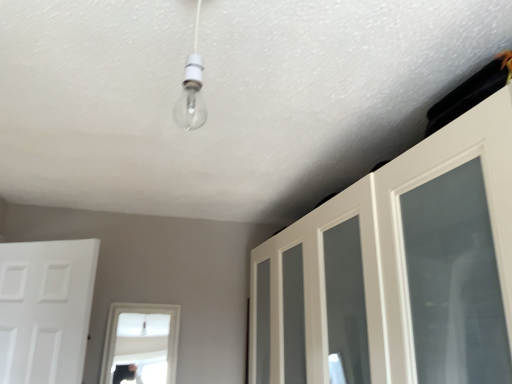
The image size is (512, 384). What do you see at coordinates (45, 309) in the screenshot? I see `white matte door at left, the first door viewed from the left` at bounding box center [45, 309].

Identify the location of white matte door at left, the second door when ordered from right to left. (45, 309).

I want to click on white glossy cabinet at upper right, marked as the 2th door in a left-to-right arrangement, so click(400, 268).

Measure the distance between point (511, 335) and camera.

Point (511, 335) and camera are 29.69 inches apart.

What is the approximate width of white glossy cabinet at upper right, which appears as the 1th door when viewed from the right?

white glossy cabinet at upper right, which appears as the 1th door when viewed from the right, is 21.11 inches in width.

This screenshot has height=384, width=512. What do you see at coordinates (400, 268) in the screenshot?
I see `white glossy cabinet at upper right, which appears as the 1th door when viewed from the right` at bounding box center [400, 268].

At what (x,y) coordinates should I click in order to perform the action: click on white matte door at left, the first door viewed from the left. Please return your answer as a coordinate pair (x, y). Image resolution: width=512 pixels, height=384 pixels. Looking at the image, I should click on (45, 309).

Is white glossy cabinet at upper right, which appears as the 1th door when viewed from the right, to the left of white matte door at left, the first door viewed from the left, from the viewer's perspective?

No, white glossy cabinet at upper right, which appears as the 1th door when viewed from the right, is not to the left of white matte door at left, the first door viewed from the left.

Between white glossy cabinet at upper right, marked as the 2th door in a left-to-right arrangement, and white matte door at left, the first door viewed from the left, which one is positioned behind?

white matte door at left, the first door viewed from the left, is further from the camera.

Between point (253, 380) and point (96, 247), which one is positioned in front?

Positioned in front is point (96, 247).

From the image's perspective, is white glossy cabinet at upper right, marked as the 2th door in a left-to-right arrangement, under white matte door at left, the first door viewed from the left?

No, from the image's perspective, white glossy cabinet at upper right, marked as the 2th door in a left-to-right arrangement, is not below white matte door at left, the first door viewed from the left.

From a real-world perspective, who is located higher, white glossy cabinet at upper right, marked as the 2th door in a left-to-right arrangement, or white matte door at left, the first door viewed from the left?

white glossy cabinet at upper right, marked as the 2th door in a left-to-right arrangement.

Considering the sizes of white glossy cabinet at upper right, marked as the 2th door in a left-to-right arrangement, and white matte door at left, the first door viewed from the left, in the image, is white glossy cabinet at upper right, marked as the 2th door in a left-to-right arrangement, wider or thinner than white matte door at left, the first door viewed from the left,?

white glossy cabinet at upper right, marked as the 2th door in a left-to-right arrangement, is wider than white matte door at left, the first door viewed from the left.

Which of these two, white glossy cabinet at upper right, marked as the 2th door in a left-to-right arrangement, or white matte door at left, the second door when ordered from right to left, stands shorter?

With less height is white matte door at left, the second door when ordered from right to left.

Considering the relative sizes of white glossy cabinet at upper right, which appears as the 1th door when viewed from the right, and white matte door at left, the second door when ordered from right to left, in the image provided, is white glossy cabinet at upper right, which appears as the 1th door when viewed from the right, bigger than white matte door at left, the second door when ordered from right to left,?

Correct, white glossy cabinet at upper right, which appears as the 1th door when viewed from the right, is larger in size than white matte door at left, the second door when ordered from right to left.

Can we say white glossy cabinet at upper right, which appears as the 1th door when viewed from the right, lies outside white matte door at left, the second door when ordered from right to left?

white glossy cabinet at upper right, which appears as the 1th door when viewed from the right, is positioned outside white matte door at left, the second door when ordered from right to left.

Is there a large distance between white glossy cabinet at upper right, marked as the 2th door in a left-to-right arrangement, and white matte door at left, the second door when ordered from right to left?

Yes, white glossy cabinet at upper right, marked as the 2th door in a left-to-right arrangement, and white matte door at left, the second door when ordered from right to left, are located far from each other.

From the picture: Could you tell me if white glossy cabinet at upper right, marked as the 2th door in a left-to-right arrangement, is turned towards white matte door at left, the second door when ordered from right to left?

Yes, white glossy cabinet at upper right, marked as the 2th door in a left-to-right arrangement, is turned towards white matte door at left, the second door when ordered from right to left.

Can you tell me how much white glossy cabinet at upper right, marked as the 2th door in a left-to-right arrangement, and white matte door at left, the second door when ordered from right to left, differ in facing direction?

The angular difference between white glossy cabinet at upper right, marked as the 2th door in a left-to-right arrangement, and white matte door at left, the second door when ordered from right to left, is 56.3 degrees.

How much distance is there between white glossy cabinet at upper right, marked as the 2th door in a left-to-right arrangement, and white matte door at left, the second door when ordered from right to left?

1.36 meters.

The height and width of the screenshot is (384, 512). I want to click on door above the white matte door at left, the first door viewed from the left (from a real-world perspective), so click(400, 268).

Is white matte door at left, the second door when ordered from right to left, to the left or to the right of white glossy cabinet at upper right, which appears as the 1th door when viewed from the right, in the image?

Based on their positions, white matte door at left, the second door when ordered from right to left, is located to the left of white glossy cabinet at upper right, which appears as the 1th door when viewed from the right.

Consider the image. Between white matte door at left, the second door when ordered from right to left, and white glossy cabinet at upper right, marked as the 2th door in a left-to-right arrangement, which one is positioned in front?

white glossy cabinet at upper right, marked as the 2th door in a left-to-right arrangement, is in front.

Between point (84, 320) and point (483, 194), which one is positioned in front?

The point (483, 194) is closer.

From the image's perspective, which one is positioned lower, white matte door at left, the second door when ordered from right to left, or white glossy cabinet at upper right, which appears as the 1th door when viewed from the right?

white matte door at left, the second door when ordered from right to left, appears lower in the image.

From a real-world perspective, is white matte door at left, the second door when ordered from right to left, above or below white glossy cabinet at upper right, marked as the 2th door in a left-to-right arrangement?

From a real-world perspective, white matte door at left, the second door when ordered from right to left, is physically below white glossy cabinet at upper right, marked as the 2th door in a left-to-right arrangement.

Considering the relative sizes of white matte door at left, the second door when ordered from right to left, and white glossy cabinet at upper right, which appears as the 1th door when viewed from the right, in the image provided, is white matte door at left, the second door when ordered from right to left, thinner than white glossy cabinet at upper right, which appears as the 1th door when viewed from the right,?

Correct, the width of white matte door at left, the second door when ordered from right to left, is less than that of white glossy cabinet at upper right, which appears as the 1th door when viewed from the right.

Considering the sizes of white matte door at left, the second door when ordered from right to left, and white glossy cabinet at upper right, which appears as the 1th door when viewed from the right, in the image, is white matte door at left, the second door when ordered from right to left, taller or shorter than white glossy cabinet at upper right, which appears as the 1th door when viewed from the right,?

In the image, white matte door at left, the second door when ordered from right to left, appears to be shorter than white glossy cabinet at upper right, which appears as the 1th door when viewed from the right.

Based on their sizes in the image, would you say white matte door at left, the second door when ordered from right to left, is bigger or smaller than white glossy cabinet at upper right, marked as the 2th door in a left-to-right arrangement?

Clearly, white matte door at left, the second door when ordered from right to left, is smaller in size than white glossy cabinet at upper right, marked as the 2th door in a left-to-right arrangement.

Would you say white matte door at left, the second door when ordered from right to left, is inside or outside white glossy cabinet at upper right, which appears as the 1th door when viewed from the right?

white matte door at left, the second door when ordered from right to left, is spatially situated outside white glossy cabinet at upper right, which appears as the 1th door when viewed from the right.

Is white matte door at left, the first door viewed from the left, not near white glossy cabinet at upper right, marked as the 2th door in a left-to-right arrangement?

Yes, white matte door at left, the first door viewed from the left, and white glossy cabinet at upper right, marked as the 2th door in a left-to-right arrangement, are quite far apart.

Is white matte door at left, the second door when ordered from right to left, looking in the opposite direction of white glossy cabinet at upper right, which appears as the 1th door when viewed from the right?

white matte door at left, the second door when ordered from right to left, does not have its back to white glossy cabinet at upper right, which appears as the 1th door when viewed from the right.

Could you measure the distance between white matte door at left, the second door when ordered from right to left, and white glossy cabinet at upper right, marked as the 2th door in a left-to-right arrangement?

white matte door at left, the second door when ordered from right to left, and white glossy cabinet at upper right, marked as the 2th door in a left-to-right arrangement, are 1.36 meters apart from each other.

This screenshot has height=384, width=512. In the image, there is a white matte door at left, the first door viewed from the left. Identify the location of door above it (from the image's perspective). (400, 268).

In order to click on door that appears behind the white glossy cabinet at upper right, marked as the 2th door in a left-to-right arrangement in this screenshot , I will do `click(45, 309)`.

Locate an element on the screen. door in front of the white matte door at left, the first door viewed from the left is located at coordinates (400, 268).